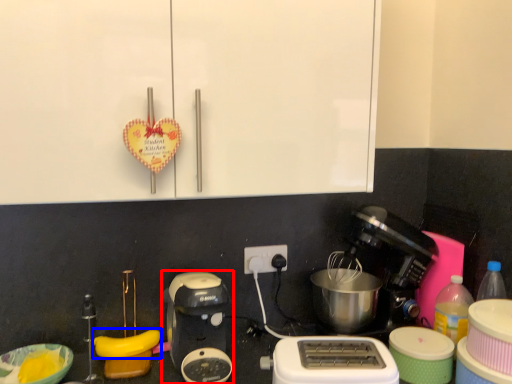
Question: Which object is further to the camera taking this photo, coffee maker (highlighted by a red box) or banana (highlighted by a blue box)?

Choices:
 (A) coffee maker
 (B) banana

Answer: (B)